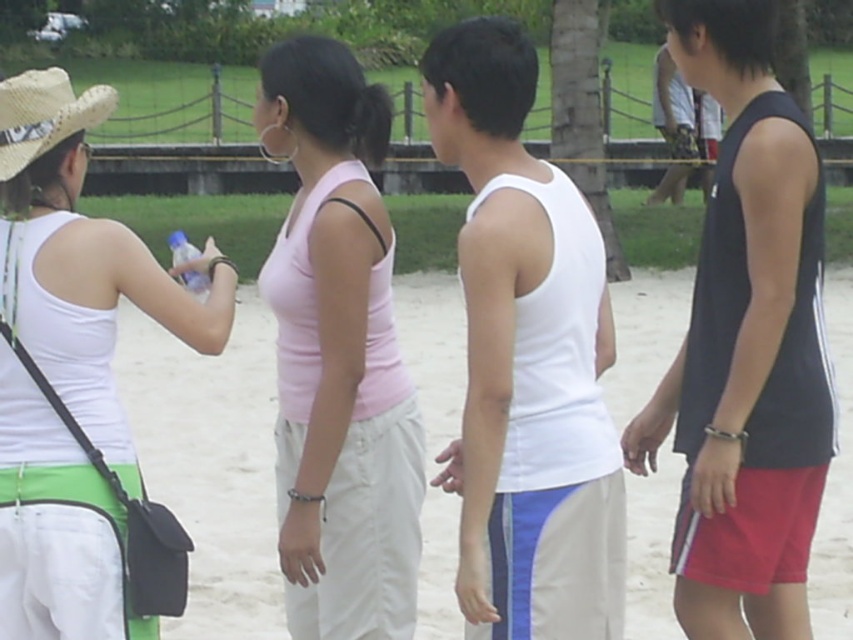
Question: Estimate the real-world distances between objects in this image. Which object is closer to the black tank top at upper right?

Choices:
 (A) beige sand at center
 (B) strawmaterial/texturecowboy hat at left
 (C) white matte tank top at center

Answer: (A)

Question: Is pink fabric tank top at center thinner than strawmaterial/texturecowboy hat at left?

Choices:
 (A) yes
 (B) no

Answer: (B)

Question: Which point is closer to the camera?

Choices:
 (A) (578, 513)
 (B) (804, 294)
 (C) (22, 333)

Answer: (A)

Question: Does white matte tank top at center appear on the right side of pink fabric tank top at center?

Choices:
 (A) no
 (B) yes

Answer: (B)

Question: Does black matte tank top at right appear on the right side of white matte tank top at left?

Choices:
 (A) no
 (B) yes

Answer: (B)

Question: Which is nearer to the black tank top at upper right?

Choices:
 (A) white matte tank top at center
 (B) strawmaterial/texturecowboy hat at left

Answer: (B)